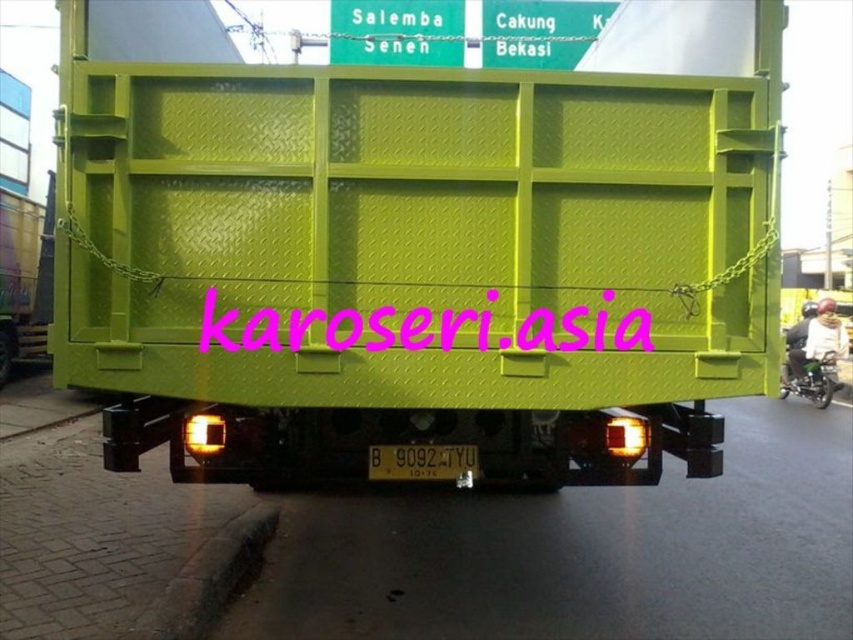
Question: From the image, what is the correct spatial relationship of pink text at center in relation to green metallic motorcycle at lower right?

Choices:
 (A) above
 (B) below

Answer: (A)

Question: Which object appears closest to the camera in this image?

Choices:
 (A) green metallic motorcycle at lower right
 (B) black plastic license plate at center

Answer: (B)

Question: Does black plastic license plate at center lie in front of green metallic motorcycle at lower right?

Choices:
 (A) no
 (B) yes

Answer: (B)

Question: Can you confirm if black plastic license plate at center is thinner than green metallic motorcycle at lower right?

Choices:
 (A) no
 (B) yes

Answer: (B)

Question: Which point is closer to the camera taking this photo?

Choices:
 (A) (474, 465)
 (B) (138, 198)
 (C) (329, 320)
 (D) (827, 358)

Answer: (C)

Question: Which is nearer to the black plastic license plate at center?

Choices:
 (A) matte green container at center
 (B) green metallic motorcycle at lower right
 (C) pink text at center

Answer: (C)